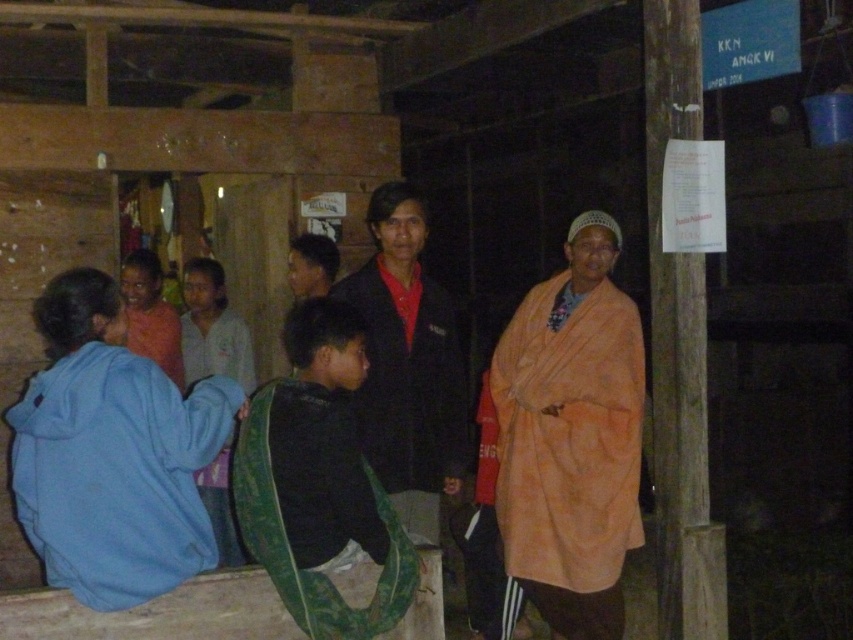
Consider the image. Is orange fabric at center thinner than matte black jacket at center?

Incorrect, orange fabric at center's width is not less than matte black jacket at center's.

Between orange fabric at center and matte black jacket at center, which one appears on the right side from the viewer's perspective?

Positioned to the right is orange fabric at center.

Identify the location of orange fabric at center. Image resolution: width=853 pixels, height=640 pixels. (572, 436).

Is point (531, 426) farther from viewer compared to point (177, 380)?

That is False.

Does orange fabric at center have a greater height compared to matte orange robe at center?

Correct, orange fabric at center is much taller as matte orange robe at center.

Which is in front, point (643, 380) or point (177, 321)?

Positioned in front is point (643, 380).

Locate an element on the screen. The width and height of the screenshot is (853, 640). orange fabric at center is located at coordinates (572, 436).

Which is more to the left, blue fleece jacket at lower left or light blue fabric at left?

Positioned to the left is light blue fabric at left.

Consider the image. Is blue fleece jacket at lower left behind light blue fabric at left?

No, blue fleece jacket at lower left is closer to the viewer.

Does point (140, 458) come closer to viewer compared to point (231, 536)?

Yes, point (140, 458) is closer to viewer.

Locate an element on the screen. This screenshot has width=853, height=640. blue fleece jacket at lower left is located at coordinates (112, 452).